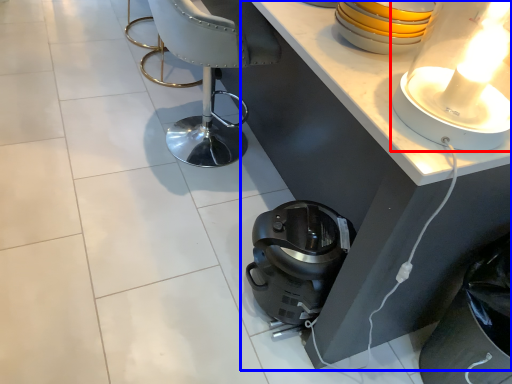
Question: Which of the following is the farthest to the observer, lamp (highlighted by a red box) or table (highlighted by a blue box)?

Choices:
 (A) lamp
 (B) table

Answer: (B)